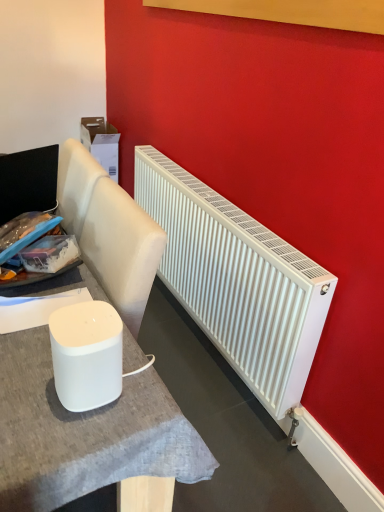
This screenshot has width=384, height=512. I want to click on free space in front of white matte speaker at lower left, so click(x=61, y=441).